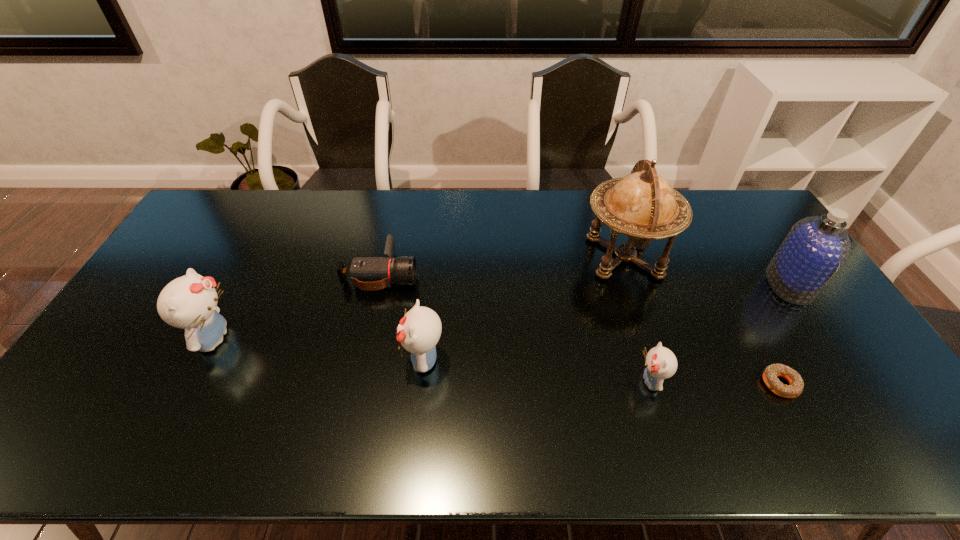
You are a GUI agent. You are given a task and a screenshot of the screen. Output one action in this format:
    pyautogui.click(x=<x>, y=<y>)
    Task: Click on the free space that satisfies the following two spatial constraints: 1. on the front-facing side of the leftmost object; 2. on the right side of the doughnut
    
    Given the screenshot: What is the action you would take?
    pyautogui.click(x=191, y=384)

Find the location of `free spot that satisfies the following two spatial constraints: 1. on the front-facing side of the rightmost kitten; 2. on the left side of the doughnut`. free spot that satisfies the following two spatial constraints: 1. on the front-facing side of the rightmost kitten; 2. on the left side of the doughnut is located at coordinates (652, 384).

Where is `free space that satisfies the following two spatial constraints: 1. on the lens of the rightmost object; 2. on the right side of the sixth tallest object`? free space that satisfies the following two spatial constraints: 1. on the lens of the rightmost object; 2. on the right side of the sixth tallest object is located at coordinates (378, 284).

Identify the location of free location that satisfies the following two spatial constraints: 1. on the front-facing side of the leftmost kitten; 2. on the left side of the shortest object. Image resolution: width=960 pixels, height=540 pixels. (191, 384).